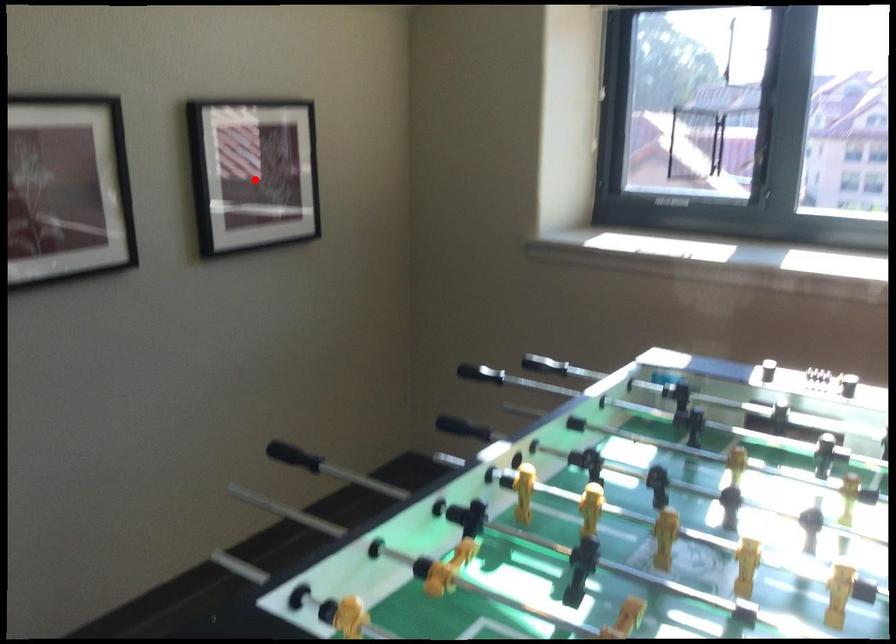
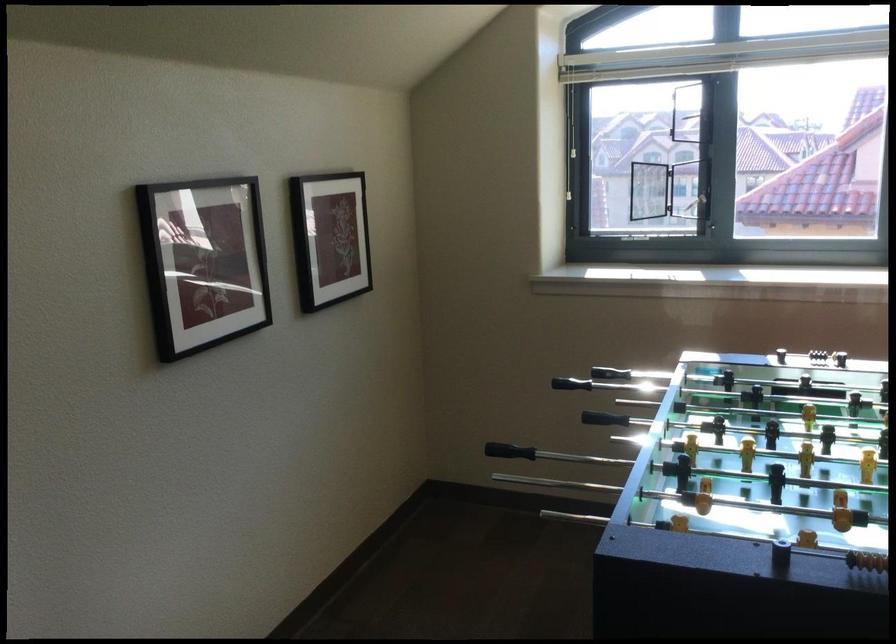
Question: I am providing you with two images of the same scene from different viewpoints. Image1 has a red point marked. In image2, the corresponding 3D location appears at what relative position? Reply with the corresponding letter.

Choices:
 (A) Closer
 (B) Farther

Answer: (B)